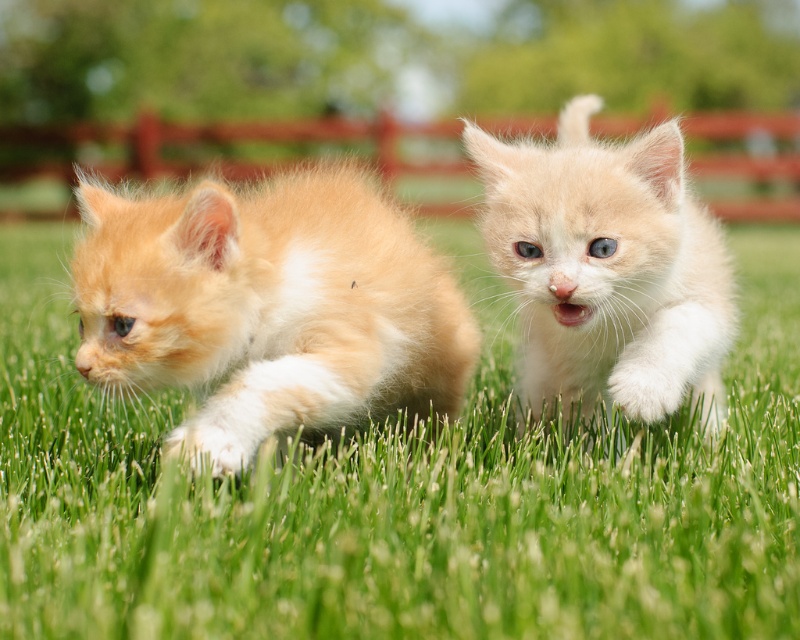
Is green grassy at center to the right of fluffy orange kitten at center from the viewer's perspective?

No, green grassy at center is not to the right of fluffy orange kitten at center.

Find the location of a particular element. The image size is (800, 640). green grassy at center is located at coordinates (400, 496).

Is point (130, 596) positioned behind point (81, 198)?

No, (130, 596) is in front of (81, 198).

Is green grassy at center to the right of fluffy orange kitten at left from the viewer's perspective?

Incorrect, green grassy at center is not on the right side of fluffy orange kitten at left.

Based on the photo, measure the distance between green grassy at center and camera.

green grassy at center is 36.33 inches from camera.

This screenshot has width=800, height=640. Find the location of `green grassy at center`. green grassy at center is located at coordinates (400, 496).

Who is positioned more to the right, fluffy orange kitten at left or fluffy orange kitten at center?

From the viewer's perspective, fluffy orange kitten at center appears more on the right side.

Image resolution: width=800 pixels, height=640 pixels. Find the location of `fluffy orange kitten at left`. fluffy orange kitten at left is located at coordinates (268, 307).